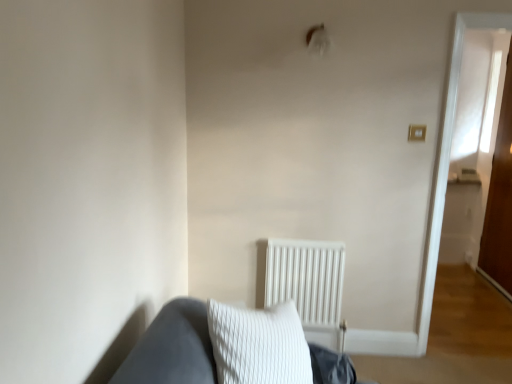
Question: Relative to white matte radiator at center, is transparent glass door at right in front or behind?

Choices:
 (A) front
 (B) behind

Answer: (B)

Question: Is transparent glass door at right wider or thinner than white matte radiator at center?

Choices:
 (A) wide
 (B) thin

Answer: (B)

Question: From a real-world perspective, is transparent glass door at right positioned above or below white matte radiator at center?

Choices:
 (A) above
 (B) below

Answer: (A)

Question: Is white matte radiator at center situated inside transparent glass door at right or outside?

Choices:
 (A) inside
 (B) outside

Answer: (B)

Question: From the image's perspective, relative to transparent glass door at right, is white matte radiator at center above or below?

Choices:
 (A) above
 (B) below

Answer: (B)

Question: Considering the positions of white matte radiator at center and transparent glass door at right in the image, is white matte radiator at center bigger or smaller than transparent glass door at right?

Choices:
 (A) big
 (B) small

Answer: (B)

Question: From a real-world perspective, is white matte radiator at center positioned above or below transparent glass door at right?

Choices:
 (A) above
 (B) below

Answer: (B)